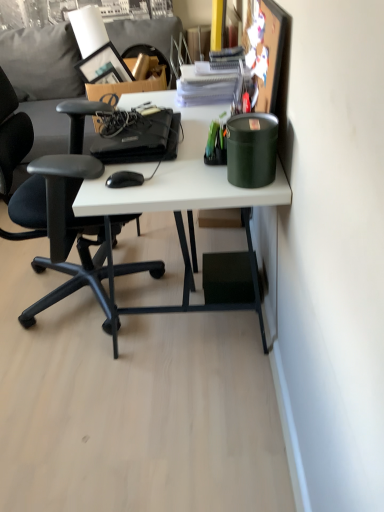
Image resolution: width=384 pixels, height=512 pixels. In order to click on free space below white matte desk at center (from a real-world perspective) in this screenshot , I will do `click(182, 290)`.